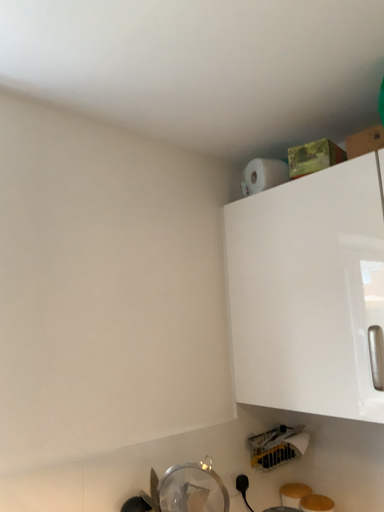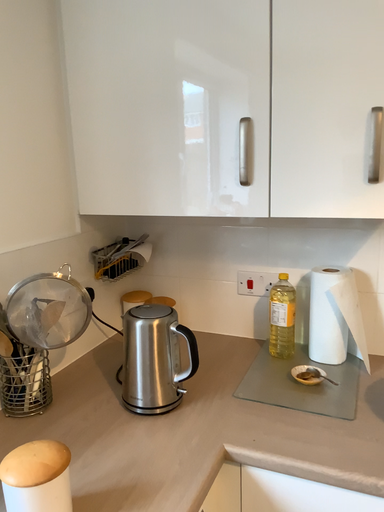
Question: Which way did the camera rotate in the video?

Choices:
 (A) rotated upward
 (B) rotated downward

Answer: (B)